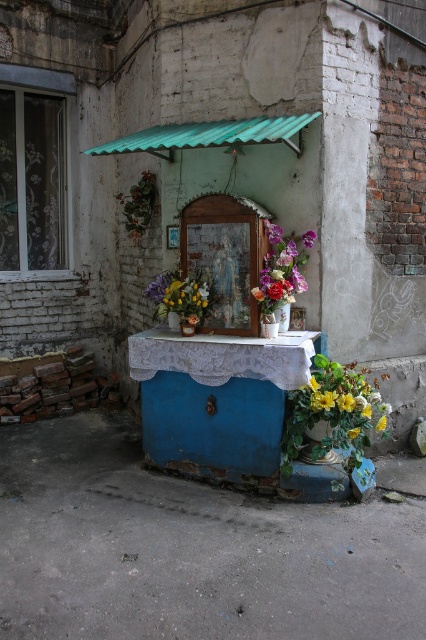
Question: Does yellow artificial flowers at lower right have a larger size compared to green corrugated metal awning at upper center?

Choices:
 (A) yes
 (B) no

Answer: (B)

Question: Does green corrugated metal awning at upper center appear under vibrant floral bouquet at center?

Choices:
 (A) no
 (B) yes

Answer: (A)

Question: Which of the following is the closest to the observer?

Choices:
 (A) (293, 282)
 (B) (285, 410)
 (C) (385, 417)
 (D) (172, 140)

Answer: (D)

Question: Is yellow artificial flowers at lower right smaller than yellow matte flower at lower right?

Choices:
 (A) yes
 (B) no

Answer: (B)

Question: Which of the following is the farthest from the observer?

Choices:
 (A) (132, 150)
 (B) (373, 410)
 (C) (305, 237)
 (D) (382, 420)

Answer: (C)

Question: Among these points, which one is farthest from the camera?

Choices:
 (A) (270, 259)
 (B) (385, 413)

Answer: (A)